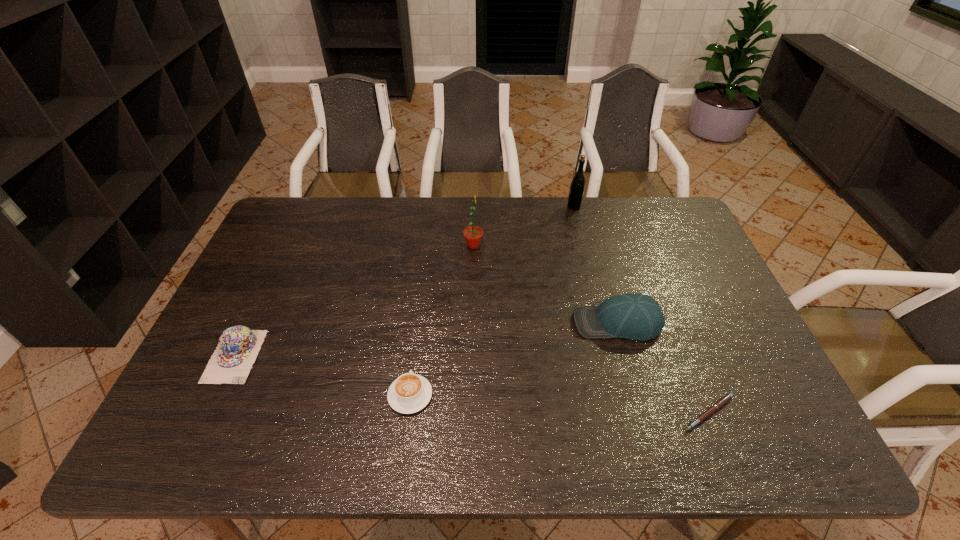
At what (x,y) coordinates should I click in order to perform the action: click on beer bottle. Please return your answer as a coordinate pair (x, y). Image resolution: width=960 pixels, height=540 pixels. Looking at the image, I should click on (577, 186).

At what (x,y) coordinates should I click in order to perform the action: click on the third object from left to right. Please return your answer as a coordinate pair (x, y). Looking at the image, I should click on (473, 234).

I want to click on sunflower, so click(473, 234).

I want to click on baseball cap, so (634, 316).

I want to click on the third shortest object, so click(x=238, y=347).

At what (x,y) coordinates should I click in order to perform the action: click on the leftmost object. Please return your answer as a coordinate pair (x, y). Looking at the image, I should click on (238, 347).

Where is `the fifth object from right to left`? The image size is (960, 540). the fifth object from right to left is located at coordinates (409, 393).

This screenshot has height=540, width=960. In order to click on cappuccino in this screenshot , I will do `click(409, 393)`.

Find the location of a particular element. the shortest object is located at coordinates (726, 398).

The image size is (960, 540). In order to click on blank area located on the left of the farthest object in this screenshot , I will do `click(459, 207)`.